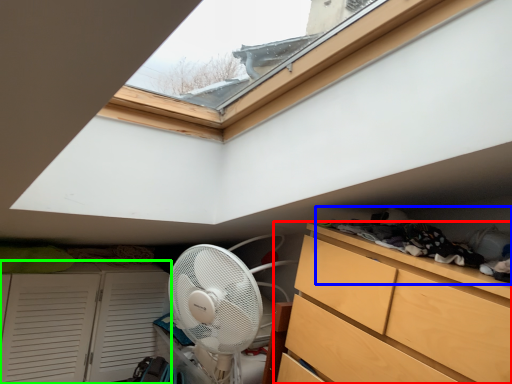
Question: Which object is the closest to the chest of drawers (highlighted by a red box)? Choose among these: laundry (highlighted by a blue box) or cupboard (highlighted by a green box).

Choices:
 (A) laundry
 (B) cupboard

Answer: (A)